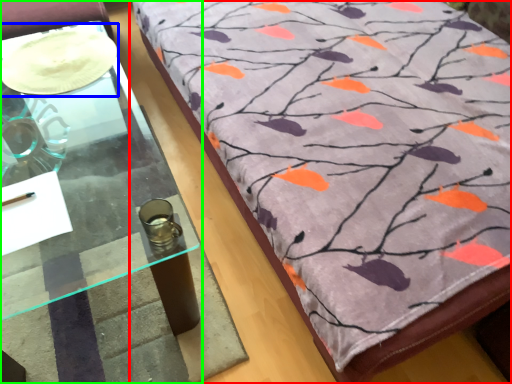
Question: Which object is the closest to the furniture (highlighted by a red box)? Choose among these: glass plate (highlighted by a blue box) or table (highlighted by a green box).

Choices:
 (A) glass plate
 (B) table

Answer: (B)